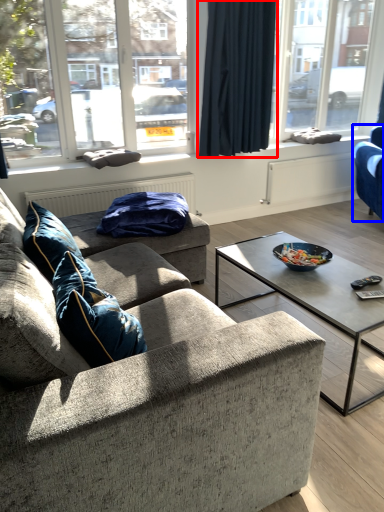
Question: Which of the following is the closest to the observer, curtain (highlighted by a red box) or studio couch (highlighted by a blue box)?

Choices:
 (A) curtain
 (B) studio couch

Answer: (A)